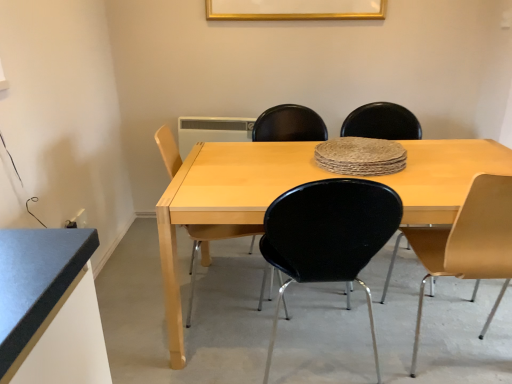
Question: Is light wood/black plastic chair at center, which is the 4th chair from right to left, a part of matte yellow chair at right, placed as the first chair when sorted from right to left?

Choices:
 (A) yes
 (B) no

Answer: (B)

Question: Is matte yellow chair at right, placed as the first chair when sorted from right to left, oriented towards light wood/black plastic chair at center, which is the 4th chair from right to left?

Choices:
 (A) yes
 (B) no

Answer: (B)

Question: Considering the relative sizes of matte yellow chair at right, placed as the first chair when sorted from right to left, and light wood/black plastic chair at center, the 1th chair when ordered from left to right, in the image provided, is matte yellow chair at right, placed as the first chair when sorted from right to left, wider than light wood/black plastic chair at center, the 1th chair when ordered from left to right,?

Choices:
 (A) no
 (B) yes

Answer: (B)

Question: Does matte yellow chair at right, placed as the first chair when sorted from right to left, touch light wood/black plastic chair at center, which is the 4th chair from right to left?

Choices:
 (A) no
 (B) yes

Answer: (A)

Question: Considering the relative positions of matte yellow chair at right, which appears as the 4th chair when viewed from the left, and light wood/black plastic chair at center, the 1th chair when ordered from left to right, in the image provided, is matte yellow chair at right, which appears as the 4th chair when viewed from the left, behind light wood/black plastic chair at center, the 1th chair when ordered from left to right,?

Choices:
 (A) yes
 (B) no

Answer: (B)

Question: Looking at the image, does gold metallic picture frame at upper center seem bigger or smaller compared to light wood/black plastic chair at center, which is the 4th chair from right to left?

Choices:
 (A) small
 (B) big

Answer: (A)

Question: Looking at their shapes, would you say gold metallic picture frame at upper center is wider or thinner than light wood/black plastic chair at center, the 1th chair when ordered from left to right?

Choices:
 (A) thin
 (B) wide

Answer: (A)

Question: Is gold metallic picture frame at upper center spatially inside light wood/black plastic chair at center, which is the 4th chair from right to left, or outside of it?

Choices:
 (A) outside
 (B) inside

Answer: (A)

Question: Considering their positions, is gold metallic picture frame at upper center located in front of or behind light wood/black plastic chair at center, the 1th chair when ordered from left to right?

Choices:
 (A) behind
 (B) front

Answer: (A)

Question: Considering the positions of point (359, 119) and point (244, 3), is point (359, 119) closer or farther from the camera than point (244, 3)?

Choices:
 (A) closer
 (B) farther

Answer: (A)

Question: Considering their positions, is matte black chair at center, which is counted as the 3th chair, starting from the left, located in front of or behind gold metallic picture frame at upper center?

Choices:
 (A) behind
 (B) front

Answer: (B)

Question: Considering the relative positions of matte black chair at center, which is counted as the 3th chair, starting from the left, and gold metallic picture frame at upper center in the image provided, is matte black chair at center, which is counted as the 3th chair, starting from the left, to the left or to the right of gold metallic picture frame at upper center?

Choices:
 (A) left
 (B) right

Answer: (B)

Question: Based on their sizes in the image, would you say matte black chair at center, placed as the second chair when sorted from right to left, is bigger or smaller than gold metallic picture frame at upper center?

Choices:
 (A) small
 (B) big

Answer: (B)

Question: From the image's perspective, is matte yellow chair at right, which appears as the 4th chair when viewed from the left, located above or below light wood/black plastic chair at center, which is the 4th chair from right to left?

Choices:
 (A) above
 (B) below

Answer: (B)

Question: Do you think matte yellow chair at right, placed as the first chair when sorted from right to left, is within light wood/black plastic chair at center, which is the 4th chair from right to left, or outside of it?

Choices:
 (A) inside
 (B) outside

Answer: (B)